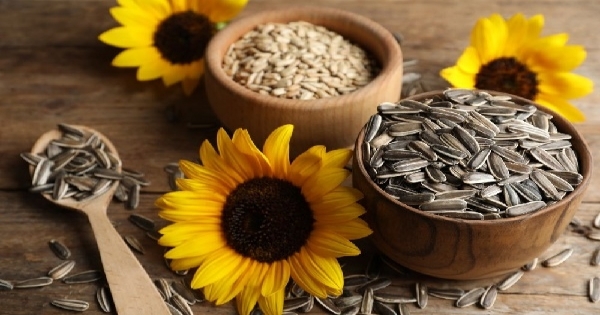
I want to click on wooden table top, so click(110, 126).